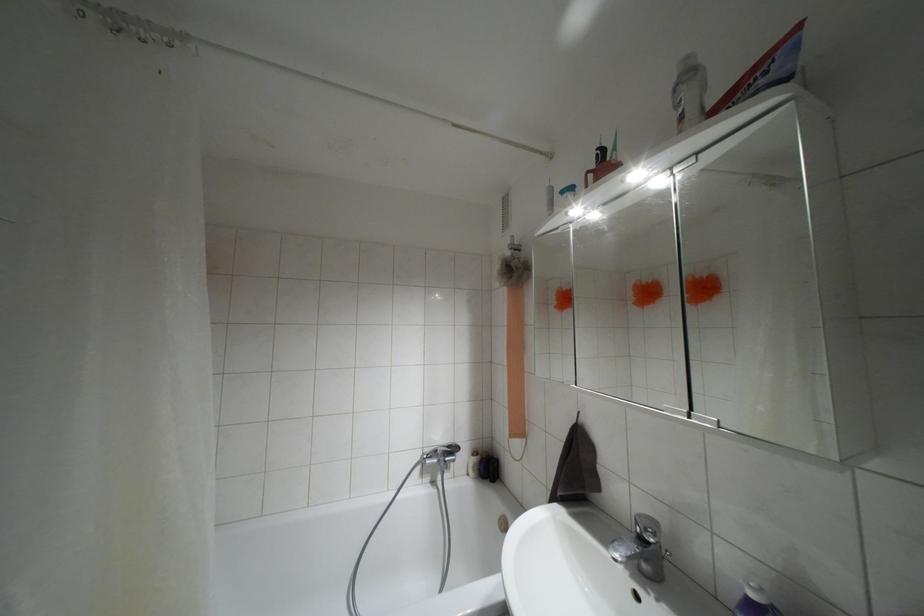
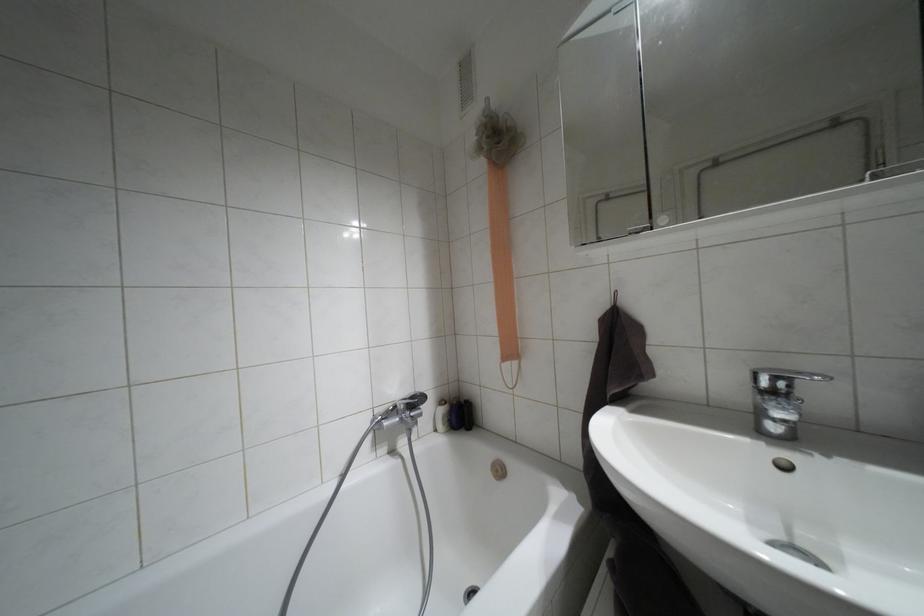
Question: The images are taken continuously from a first-person perspective. In which direction is your viewpoint rotating?

Choices:
 (A) Left
 (B) Right
 (C) Up
 (D) Down

Answer: (B)